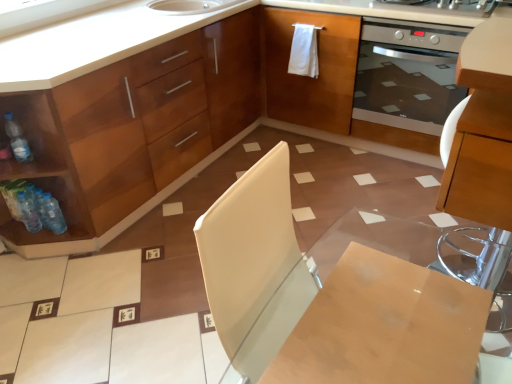
Question: Is translucent plastic bottles at lower left, the 2th bottle when ordered from bottom to top, turned away from wooden table at center?

Choices:
 (A) yes
 (B) no

Answer: (B)

Question: Can you confirm if translucent plastic bottles at lower left, the 2th bottle when ordered from bottom to top, is thinner than wooden table at center?

Choices:
 (A) yes
 (B) no

Answer: (A)

Question: Are translucent plastic bottles at lower left, the 2th bottle when ordered from bottom to top, and wooden table at center located far from each other?

Choices:
 (A) yes
 (B) no

Answer: (A)

Question: Is the surface of translucent plastic bottles at lower left, the 2th bottle when ordered from bottom to top, in direct contact with wooden table at center?

Choices:
 (A) no
 (B) yes

Answer: (A)

Question: Is translucent plastic bottles at lower left, the 2th bottle when ordered from bottom to top, surrounding wooden table at center?

Choices:
 (A) no
 (B) yes

Answer: (A)

Question: Considering the positions of satin silver oven at right and clear plastic bottle at left, the 1th bottle in the top-to-bottom sequence, in the image, is satin silver oven at right bigger or smaller than clear plastic bottle at left, the 1th bottle in the top-to-bottom sequence,?

Choices:
 (A) big
 (B) small

Answer: (A)

Question: In terms of width, does satin silver oven at right look wider or thinner when compared to clear plastic bottle at left, the 1th bottle in the top-to-bottom sequence?

Choices:
 (A) wide
 (B) thin

Answer: (A)

Question: Based on their positions, is satin silver oven at right located to the left or right of clear plastic bottle at left, the 1th bottle in the top-to-bottom sequence?

Choices:
 (A) left
 (B) right

Answer: (B)

Question: Is point (364, 31) closer or farther from the camera than point (18, 158)?

Choices:
 (A) farther
 (B) closer

Answer: (A)

Question: Is stainless steel oven at upper right inside or outside of clear plastic bottle at left, marked as the third bottle in a bottom-to-top arrangement?

Choices:
 (A) outside
 (B) inside

Answer: (A)

Question: Considering the positions of stainless steel oven at upper right and clear plastic bottle at left, marked as the third bottle in a bottom-to-top arrangement, in the image, is stainless steel oven at upper right bigger or smaller than clear plastic bottle at left, marked as the third bottle in a bottom-to-top arrangement,?

Choices:
 (A) small
 (B) big

Answer: (B)

Question: In terms of height, does stainless steel oven at upper right look taller or shorter compared to clear plastic bottle at left, the 1th bottle in the top-to-bottom sequence?

Choices:
 (A) short
 (B) tall

Answer: (A)

Question: Looking at their shapes, would you say stainless steel oven at upper right is wider or thinner than clear plastic bottle at left, marked as the third bottle in a bottom-to-top arrangement?

Choices:
 (A) wide
 (B) thin

Answer: (A)

Question: Considering the positions of translucent plastic bottle at lower left, which is the 3th bottle from top to bottom, and wooden table at center in the image, is translucent plastic bottle at lower left, which is the 3th bottle from top to bottom, taller or shorter than wooden table at center?

Choices:
 (A) tall
 (B) short

Answer: (A)

Question: From the image's perspective, relative to wooden table at center, is translucent plastic bottle at lower left, the first bottle from the bottom, above or below?

Choices:
 (A) above
 (B) below

Answer: (A)